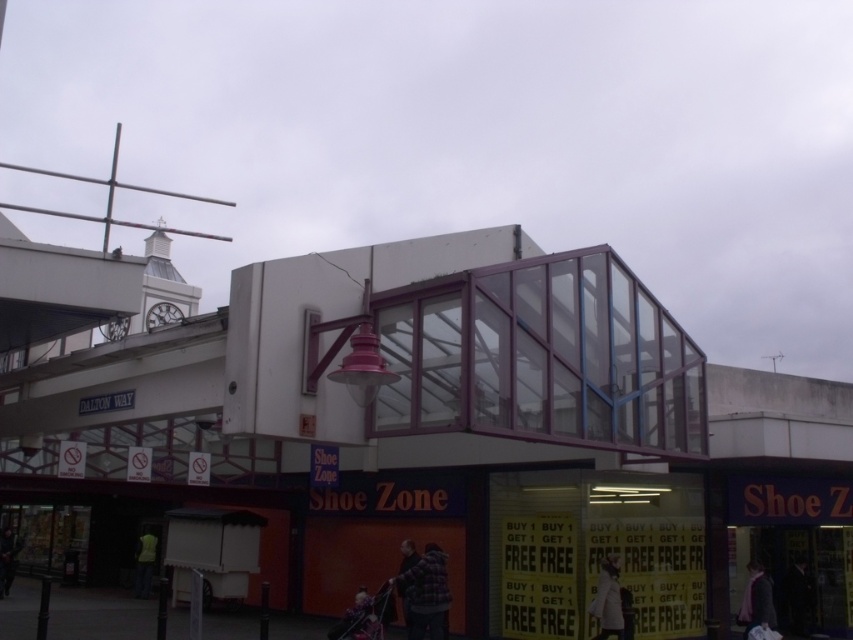
You are a customer looking at the dark blue coat at lower right and the leather jacket at lower center in the Shoe Zone store. Which item is closer to the ground?

The dark blue coat at lower right is closer to the ground because it is positioned under the leather jacket at lower center.

You are a customer looking to hang a new coat on a rack located between the dark blue coat at lower right and the leather jacket at lower center. The rack has limited vertical space. Based on their heights, which item should you move to make space?

The dark blue coat at lower right is taller than the leather jacket at lower center. To make space on the rack, you should move the dark blue coat at lower right since it occupies more vertical space.